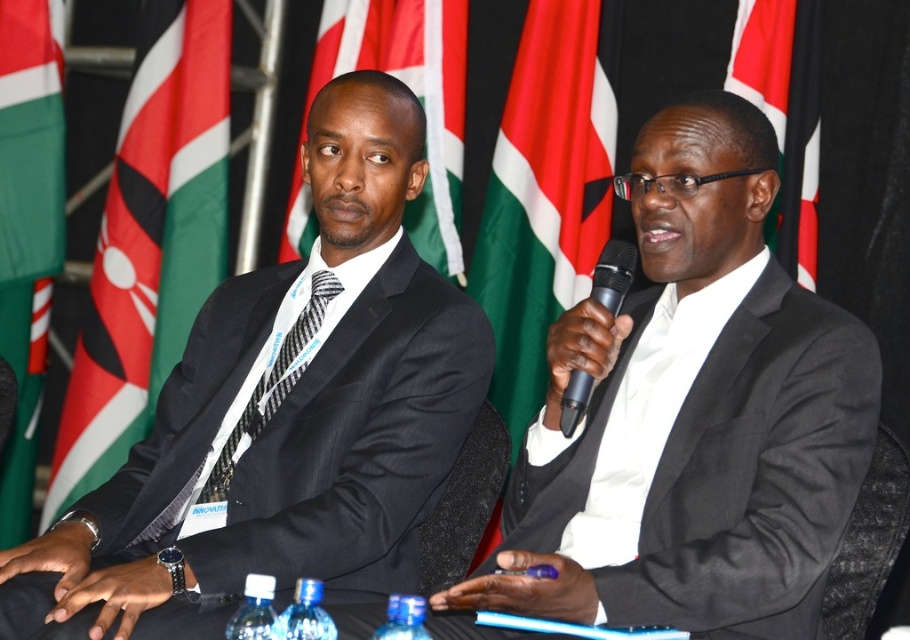
Who is higher up, red fabric flag at upper left or green fabric flag at upper left?

green fabric flag at upper left is above.

Who is more distant from viewer, (221, 260) or (2, 477)?

Positioned behind is point (2, 477).

The height and width of the screenshot is (640, 910). What are the coordinates of `red fabric flag at upper left` in the screenshot? It's located at (149, 243).

What do you see at coordinates (284, 413) in the screenshot?
I see `matte black suit at left` at bounding box center [284, 413].

Is point (228, 388) positioned in front of point (322, 298)?

Yes.

Locate an element on the screen. This screenshot has height=640, width=910. matte black suit at left is located at coordinates (284, 413).

In the scene shown: Can you confirm if matte black suit at left is positioned above green fabric flag at upper center?

Actually, matte black suit at left is below green fabric flag at upper center.

Who is shorter, matte black suit at left or green fabric flag at upper center?

green fabric flag at upper center

Does point (278, 564) come behind point (297, 179)?

No, (278, 564) is closer to viewer.

Where is `matte black suit at left`? Image resolution: width=910 pixels, height=640 pixels. matte black suit at left is located at coordinates (284, 413).